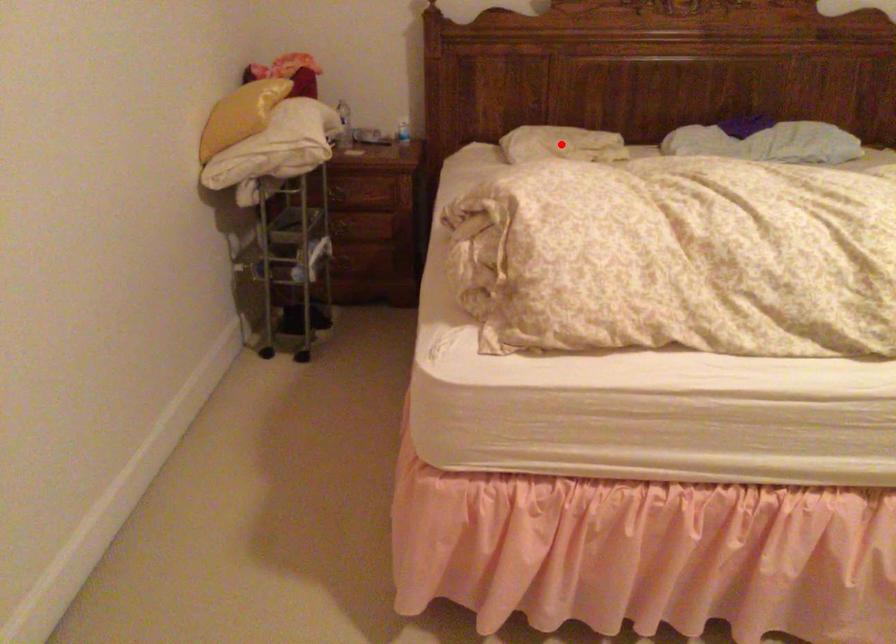
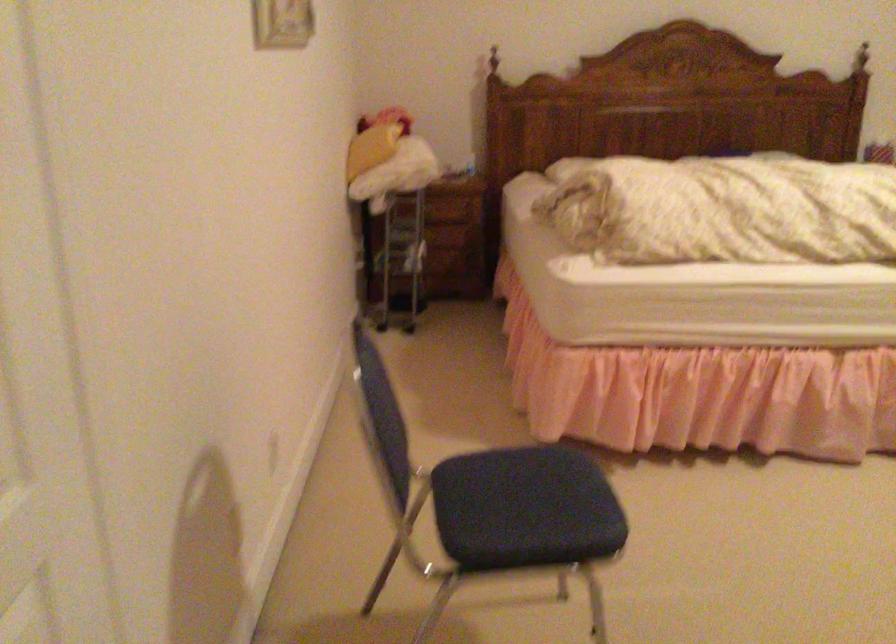
Question: I am providing you with two images of the same scene from different viewpoints. A red point is marked on the first image. At the location where the point appears in image 1, is it still visible in image 2?

Choices:
 (A) Yes
 (B) No

Answer: (B)